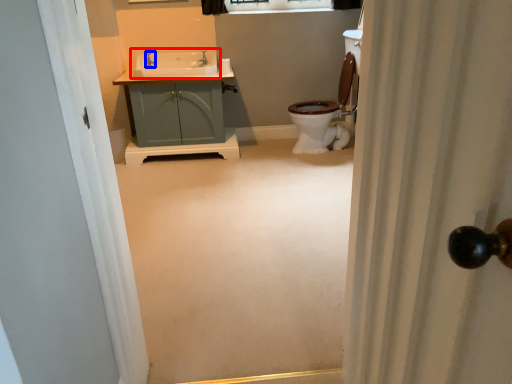
Question: Which point is further to the camera, sink (highlighted by a red box) or faucet (highlighted by a blue box)?

Choices:
 (A) sink
 (B) faucet

Answer: (B)